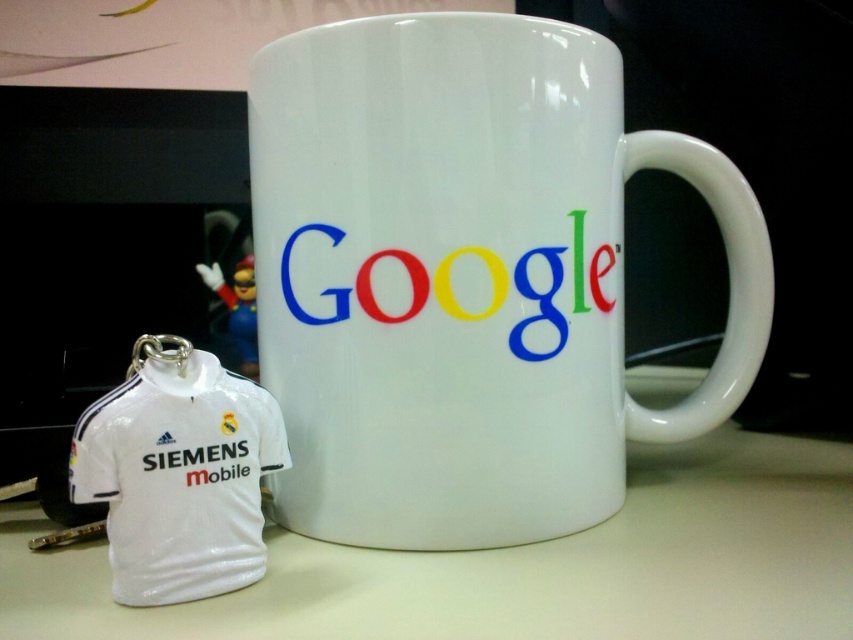
Based on the photo, you are arranging items on a desk and want to place a new object between the white matte table at lower center and the smooth glossy google logo at center. Is there enough space for the object?

The white matte table at lower center is positioned under the smooth glossy google logo at center, meaning they are vertically aligned. Since the table is beneath the logo, there isn

You are organizing a desk and need to place a small sticker on the tallest object between the white glossy mug at center and the smooth glossy google logo at center. Which object should you choose?

The white glossy mug at center is taller than the smooth glossy google logo at center, so you should place the sticker on the white glossy mug at center.

You are standing in front of a desk with the white ceramic mug and the small keychain shaped like a white soccer jersey with black stripes on the shoulders. You want to place a new object exactly at the point marked as point (465, 276). Can you confirm if this location is currently occupied?

Yes, the location at point (465, 276) is occupied by the white glossy mug at center.